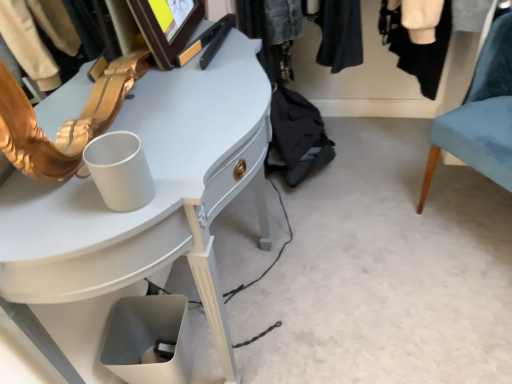
Question: Based on their positions, is denim jacket at upper center located to the left or right of white glossy desk at upper left?

Choices:
 (A) left
 (B) right

Answer: (B)

Question: Is denim jacket at upper center in front of or behind white glossy desk at upper left in the image?

Choices:
 (A) front
 (B) behind

Answer: (B)

Question: Which is farther from the denim jacket at upper center?

Choices:
 (A) white glossy desk at upper left
 (B) velvet teal chair at right

Answer: (A)

Question: Which of these objects is positioned farthest from the denim jacket at upper center?

Choices:
 (A) white glossy desk at upper left
 (B) velvet teal chair at right

Answer: (A)